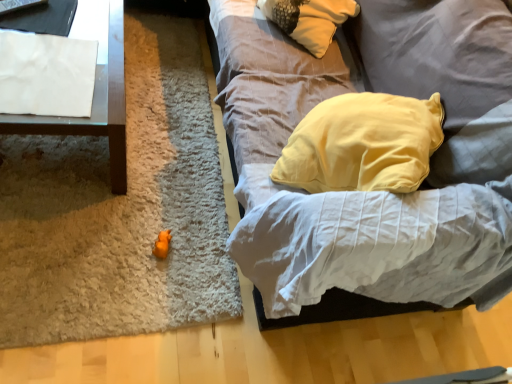
Question: Is white paper at upper left wider than soft gray fabric couch at center?

Choices:
 (A) yes
 (B) no

Answer: (B)

Question: Is white paper at upper left far away from soft gray fabric couch at center?

Choices:
 (A) yes
 (B) no

Answer: (B)

Question: Considering the relative positions of white paper at upper left and soft gray fabric couch at center in the image provided, is white paper at upper left behind soft gray fabric couch at center?

Choices:
 (A) yes
 (B) no

Answer: (A)

Question: From a real-world perspective, is white paper at upper left physically below soft gray fabric couch at center?

Choices:
 (A) no
 (B) yes

Answer: (B)

Question: Is white paper at upper left in contact with soft gray fabric couch at center?

Choices:
 (A) no
 (B) yes

Answer: (A)

Question: From a real-world perspective, does white paper at upper left stand above soft gray fabric couch at center?

Choices:
 (A) no
 (B) yes

Answer: (A)

Question: Is white paper at upper left located outside white paper at left?

Choices:
 (A) no
 (B) yes

Answer: (A)

Question: Is white paper at upper left wider than white paper at left?

Choices:
 (A) yes
 (B) no

Answer: (B)

Question: From the image's perspective, would you say white paper at upper left is shown under white paper at left?

Choices:
 (A) no
 (B) yes

Answer: (B)

Question: Is white paper at upper left smaller than white paper at left?

Choices:
 (A) yes
 (B) no

Answer: (A)

Question: Is white paper at upper left taller than white paper at left?

Choices:
 (A) no
 (B) yes

Answer: (A)

Question: Is white paper at upper left looking in the opposite direction of white paper at left?

Choices:
 (A) no
 (B) yes

Answer: (B)

Question: Does soft gray fabric couch at center have a greater height compared to white paper at left?

Choices:
 (A) no
 (B) yes

Answer: (B)